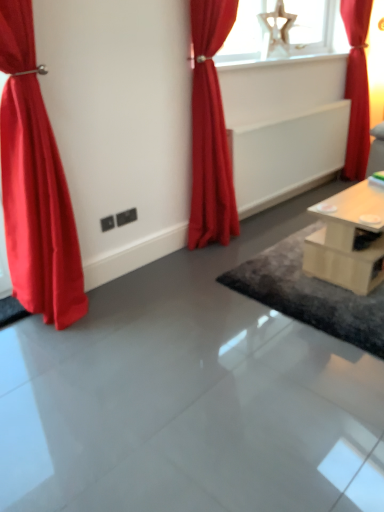
Question: Is light wood table at right next to white glossy radiator at upper center and touching it?

Choices:
 (A) no
 (B) yes

Answer: (A)

Question: Is light wood table at right surrounding white glossy radiator at upper center?

Choices:
 (A) yes
 (B) no

Answer: (B)

Question: Are light wood table at right and white glossy radiator at upper center located far from each other?

Choices:
 (A) no
 (B) yes

Answer: (B)

Question: Is light wood table at right shorter than white glossy radiator at upper center?

Choices:
 (A) yes
 (B) no

Answer: (B)

Question: Considering the relative sizes of light wood table at right and white glossy radiator at upper center in the image provided, is light wood table at right thinner than white glossy radiator at upper center?

Choices:
 (A) yes
 (B) no

Answer: (B)

Question: Is white glossy radiator at upper center at the back of light wood table at right?

Choices:
 (A) yes
 (B) no

Answer: (B)

Question: From the image's perspective, would you say matte red curtain at center, positioned as the second curtain in left-to-right order, is positioned over dark gray textured rug at center?

Choices:
 (A) yes
 (B) no

Answer: (A)

Question: Are matte red curtain at center, the 2th curtain from the right, and dark gray textured rug at center located far from each other?

Choices:
 (A) yes
 (B) no

Answer: (B)

Question: Considering the relative sizes of matte red curtain at center, which is the 2th curtain from back to front, and dark gray textured rug at center in the image provided, is matte red curtain at center, which is the 2th curtain from back to front, bigger than dark gray textured rug at center?

Choices:
 (A) no
 (B) yes

Answer: (B)

Question: Does matte red curtain at center, acting as the second curtain starting from the front, contain dark gray textured rug at center?

Choices:
 (A) yes
 (B) no

Answer: (B)

Question: Considering the relative positions of matte red curtain at center, positioned as the second curtain in left-to-right order, and dark gray textured rug at center in the image provided, is matte red curtain at center, positioned as the second curtain in left-to-right order, to the left of dark gray textured rug at center from the viewer's perspective?

Choices:
 (A) no
 (B) yes

Answer: (B)

Question: Considering the relative sizes of matte red curtain at center, the 2th curtain from the right, and dark gray textured rug at center in the image provided, is matte red curtain at center, the 2th curtain from the right, wider than dark gray textured rug at center?

Choices:
 (A) yes
 (B) no

Answer: (B)

Question: From a real-world perspective, does light wood table at right sit lower than dark gray textured rug at center?

Choices:
 (A) yes
 (B) no

Answer: (B)